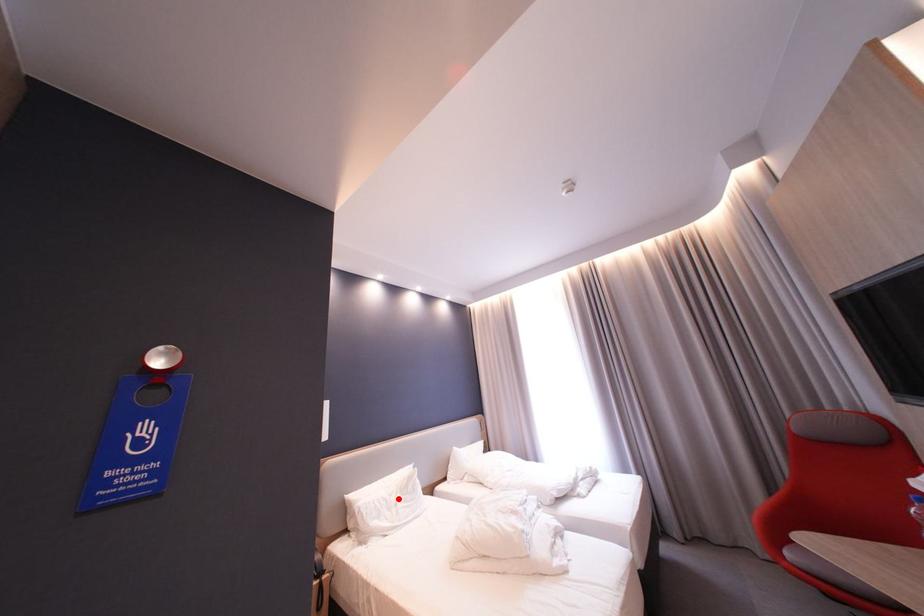
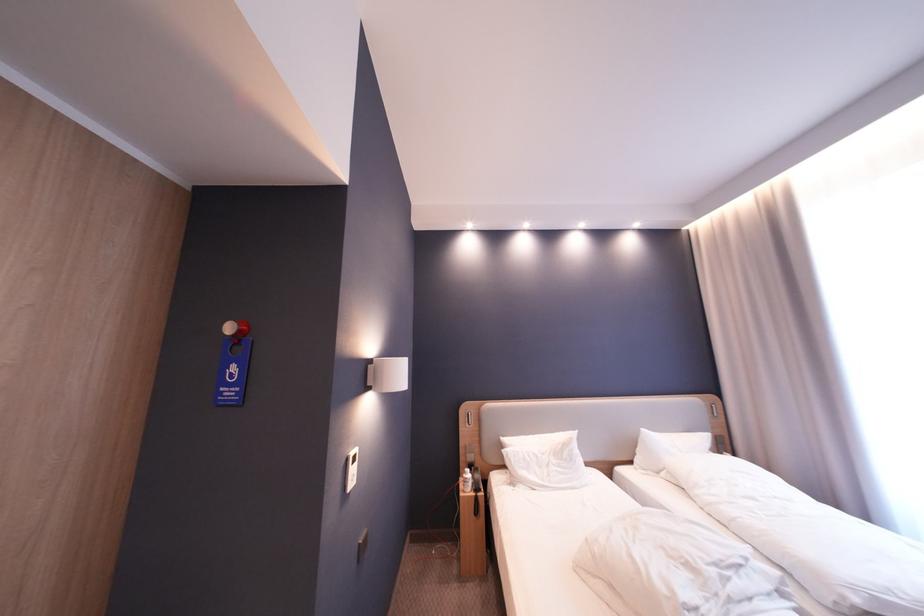
The point at the highlighted location is marked in the first image. Where is the corresponding point in the second image?

(550, 456)